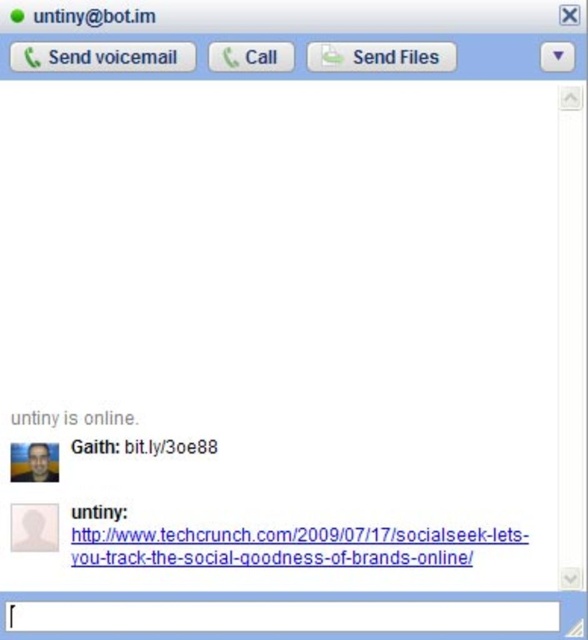
You are using a mobile phone with a 5.5 inch screen. You want to tap on the black link at center but accidentally touched the black text at upper center. How far did you miss by in inches?

The black link at center and the black text at upper center are 4.33 inches apart. Since you missed by tapping the black text at upper center instead of the black link at center, you missed by 4.33 inches.

You are a user trying to click on the black link at center and the gray text at center in the messaging interface. Which one is closer to you?

The black link at center is closer to you than the gray text at center because it is further to the viewer.

You are using a messaging app and want to click on the black link at center. Based on its coordinates, can you determine if it is closer to the top or bottom of the screen?

The black link at center is located at point 0.698 on the vertical axis, which places it closer to the bottom of the screen since 0.698 is closer to 1 than to 0.